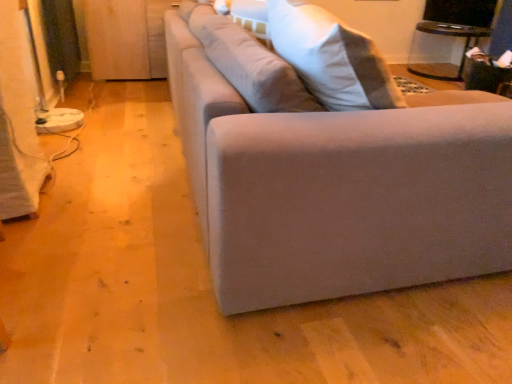
Question: From a real-world perspective, is transparent glass table at upper right located beneath wooden at left?

Choices:
 (A) no
 (B) yes

Answer: (B)

Question: Does transparent glass table at upper right have a greater width compared to wooden at left?

Choices:
 (A) yes
 (B) no

Answer: (A)

Question: From the image's perspective, does transparent glass table at upper right appear lower than wooden at left?

Choices:
 (A) yes
 (B) no

Answer: (B)

Question: Considering the relative sizes of transparent glass table at upper right and wooden at left in the image provided, is transparent glass table at upper right thinner than wooden at left?

Choices:
 (A) no
 (B) yes

Answer: (A)

Question: Does transparent glass table at upper right contain wooden at left?

Choices:
 (A) yes
 (B) no

Answer: (B)

Question: Is the depth of transparent glass table at upper right less than that of wooden at left?

Choices:
 (A) yes
 (B) no

Answer: (B)

Question: Does wooden at left lie in front of transparent glass table at upper right?

Choices:
 (A) no
 (B) yes

Answer: (B)

Question: Considering the relative sizes of wooden at left and transparent glass table at upper right in the image provided, is wooden at left wider than transparent glass table at upper right?

Choices:
 (A) no
 (B) yes

Answer: (A)

Question: Is wooden at left looking in the opposite direction of transparent glass table at upper right?

Choices:
 (A) yes
 (B) no

Answer: (B)

Question: Is wooden at left far away from transparent glass table at upper right?

Choices:
 (A) yes
 (B) no

Answer: (A)

Question: Can you confirm if wooden at left is thinner than transparent glass table at upper right?

Choices:
 (A) yes
 (B) no

Answer: (A)

Question: Is wooden at left located outside transparent glass table at upper right?

Choices:
 (A) yes
 (B) no

Answer: (A)

Question: Does transparent glass table at upper right have a greater width compared to suede-like beige couch at center?

Choices:
 (A) yes
 (B) no

Answer: (B)